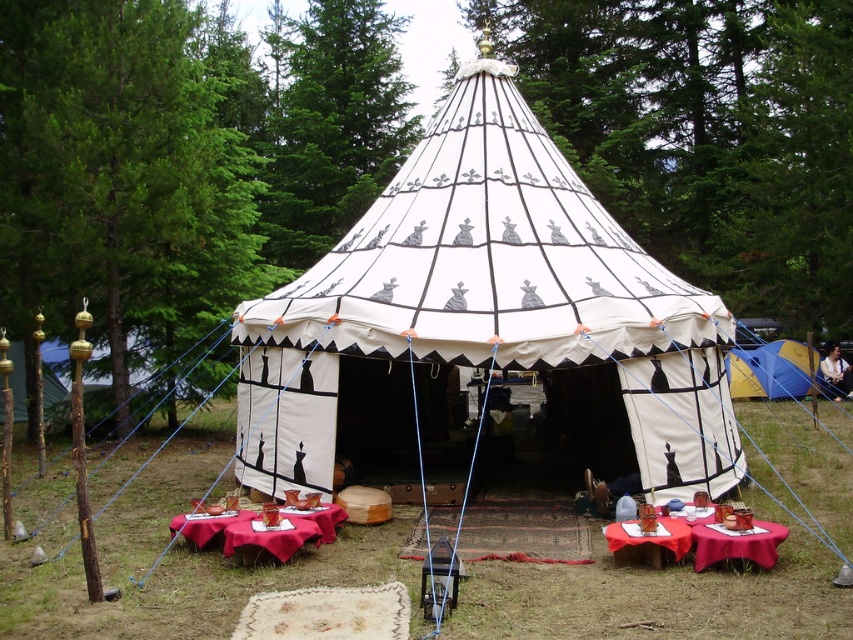
You are planning to set up a flagpole for a small flag. The flagpole needs to be placed in such a way that it can be seen clearly from both the white canvas tent at center and the blue canvas tent at right. Considering their heights, which tent should the flagpole be placed closer to?

The white canvas tent at center is taller than the blue canvas tent at right. To ensure the flagpole is visible from both tents, it should be placed closer to the shorter blue canvas tent at right so that the taller white canvas tent at center doesn

In the scene shown: You are planning to set up a picnic blanket for a group of 6 people. The picnic blanket is the size of the smooth red cloth at lower center. Will the white canvas tent at center fit on the picnic blanket if you wanted to place it there?

The white canvas tent at center is wider than the smooth red cloth at lower center, so it won